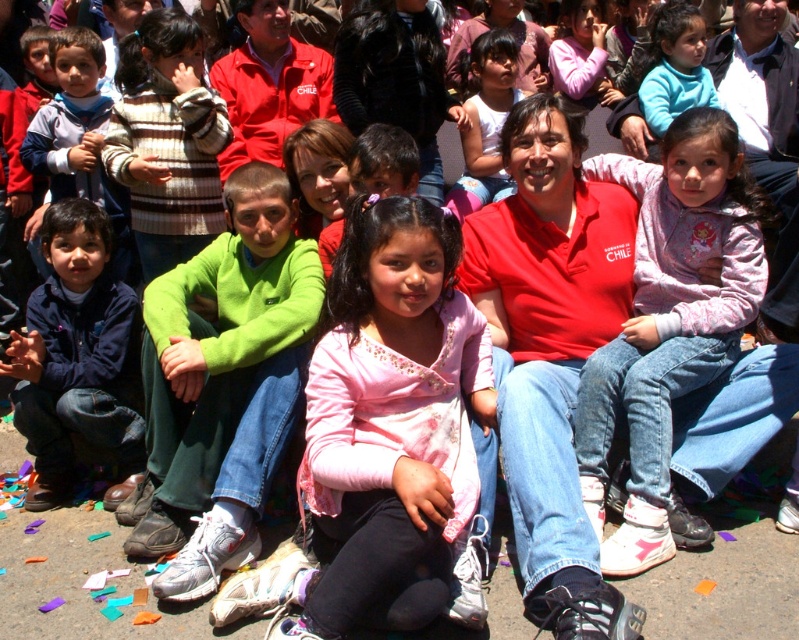
Who is lower down, dark blue denim jeans at lower left or matte blue sweater at upper right?

dark blue denim jeans at lower left is lower down.

Does dark blue denim jeans at lower left appear on the right side of matte blue sweater at upper right?

Incorrect, dark blue denim jeans at lower left is not on the right side of matte blue sweater at upper right.

Is point (98, 385) in front of point (678, 74)?

That is True.

I want to click on dark blue denim jeans at lower left, so click(x=78, y=358).

Who is shorter, dark blue denim jeans at lower left or striped sweater at left?

Standing shorter between the two is dark blue denim jeans at lower left.

Is the position of dark blue denim jeans at lower left more distant than that of striped sweater at left?

That is False.

The image size is (799, 640). In order to click on dark blue denim jeans at lower left in this screenshot , I will do `click(78, 358)`.

Consider the image. Can you confirm if pink fleece jacket at center is thinner than striped sweater at left?

Yes.

Between pink fleece jacket at center and striped sweater at left, which one has less height?

striped sweater at left

Is point (721, 234) closer to viewer compared to point (177, 131)?

Yes, it is in front of point (177, 131).

I want to click on pink fleece jacket at center, so click(x=668, y=320).